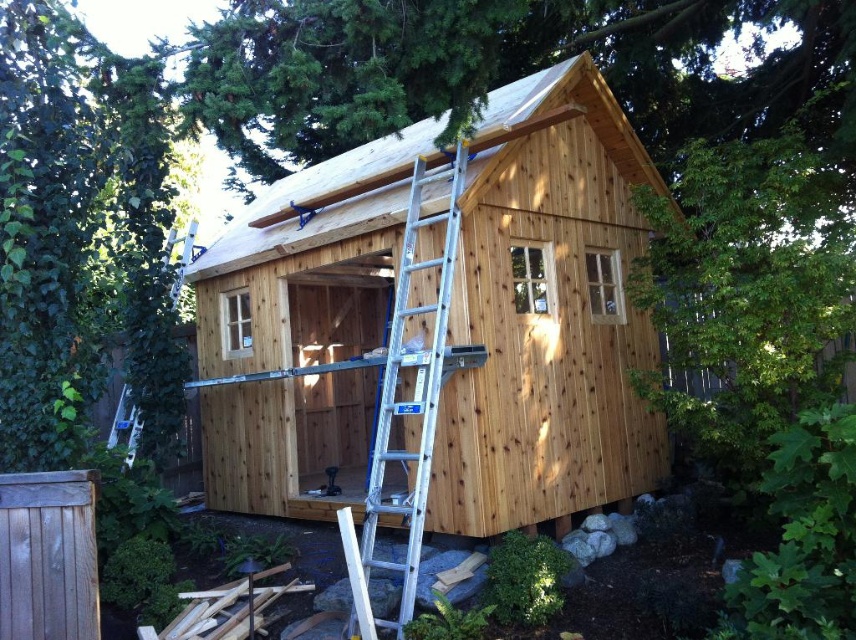
You are a contractor assessing the construction site. You need to determine if the silver aluminum ladder at center can be safely leaned against the natural wood cabin at center without exceeding its height. Can it be done?

The natural wood cabin at center is shorter than the silver aluminum ladder at center, so leaning the ladder against it may not be safe as the ladder extends beyond the cabin height.

You are a painter standing at the front of the natural wood cabin at center and need to paint the silver aluminum ladder at center. Which object requires more horizontal space to maneuver around?

The natural wood cabin at center requires more horizontal space to maneuver around since it is wider than the silver aluminum ladder at center.